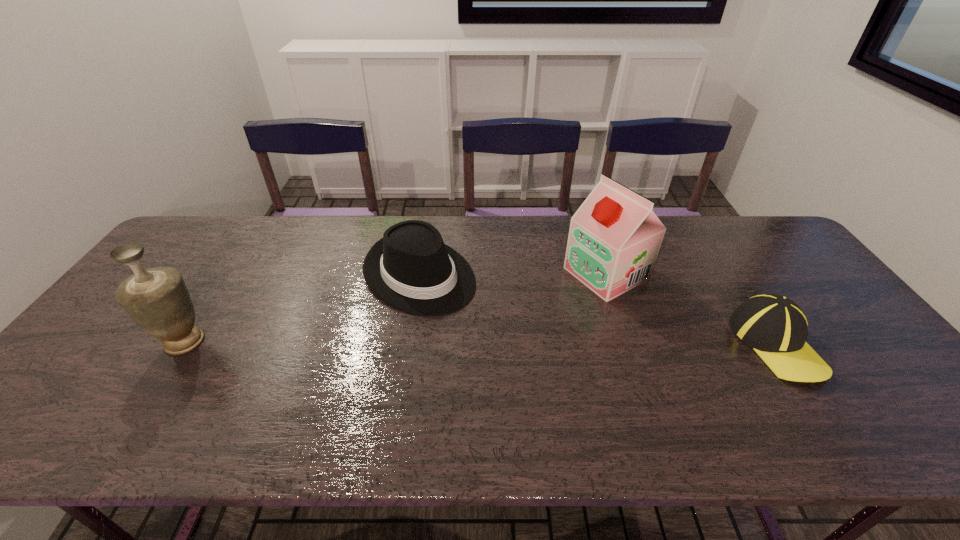
You are a GUI agent. You are given a task and a screenshot of the screen. Output one action in this format:
    pyautogui.click(x=<x>, y=<y>)
    Task: Click on the vacant region at the near edge of the desktop
    The image size is (960, 540).
    Given the screenshot: What is the action you would take?
    tap(779, 394)

The height and width of the screenshot is (540, 960). Identify the location of vacant position at the left edge of the desktop. (141, 334).

Find the location of a particular element. The image size is (960, 540). blank space at the far right corner of the desktop is located at coordinates (743, 251).

The image size is (960, 540). Identify the location of unoccupied position between the soya milk and the shortest object. (691, 309).

Identify the location of free spot between the second shortest object and the rightmost object. (597, 309).

Identify the location of free spot between the rightmost object and the third object from right to left. (597, 309).

Where is `vacant point located between the leftmost object and the rightmost object`? vacant point located between the leftmost object and the rightmost object is located at coordinates (480, 343).

You are a GUI agent. You are given a task and a screenshot of the screen. Output one action in this format:
    pyautogui.click(x=<x>, y=<y>)
    Task: Click on the vacant area that lies between the baseball cap and the third tallest object
    
    Given the screenshot: What is the action you would take?
    pyautogui.click(x=597, y=309)

Where is `free space between the shortest object and the third object from right to left`? free space between the shortest object and the third object from right to left is located at coordinates pos(597,309).

You are a GUI agent. You are given a task and a screenshot of the screen. Output one action in this format:
    pyautogui.click(x=<x>, y=<y>)
    Task: Click on the blank region between the baseball cap and the third object from right to left
    
    Given the screenshot: What is the action you would take?
    pyautogui.click(x=597, y=309)